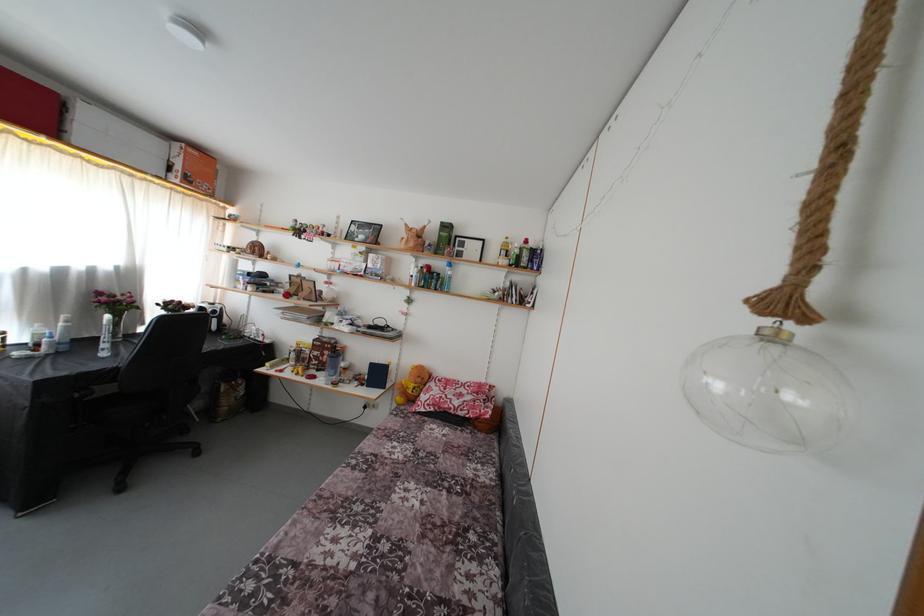
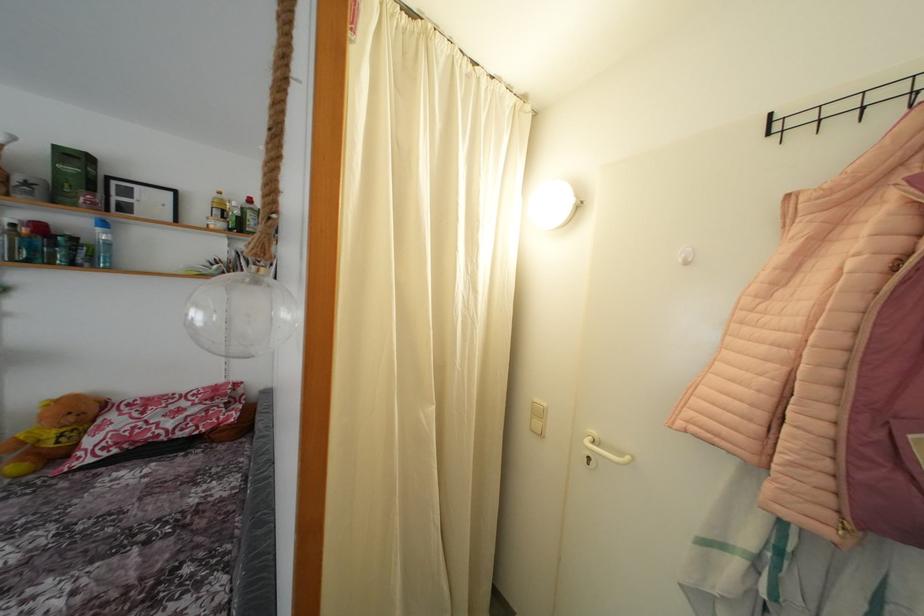
In the second image, find the point that corresponds to (x=453, y=274) in the first image.

(104, 236)